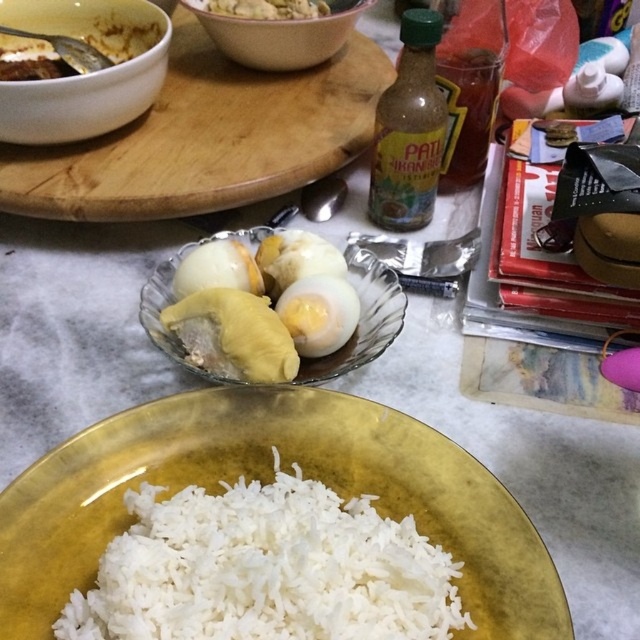
Which of these two, translucent glass bowl at center or smooth white rice at bottom, stands taller?

translucent glass bowl at center

Does point (161, 272) come in front of point (234, 13)?

Yes, it is in front of point (234, 13).

Which is behind, point (189, 369) or point (241, 4)?

Point (241, 4)

Where is `translucent glass bowl at center`? The image size is (640, 640). translucent glass bowl at center is located at coordinates (364, 320).

At what (x,y) coordinates should I click in order to perform the action: click on pink ceramic bowl at upper center. Please return your answer as a coordinate pair (x, y). This screenshot has height=640, width=640. Looking at the image, I should click on (276, 36).

Between pink ceramic bowl at upper center and yellow matte durian at center, which one appears on the left side from the viewer's perspective?

From the viewer's perspective, yellow matte durian at center appears more on the left side.

Is point (237, 28) behind point (193, 278)?

Yes, point (237, 28) is behind point (193, 278).

Find the location of `pink ceramic bowl at upper center`. pink ceramic bowl at upper center is located at coordinates (276, 36).

Who is positioned more to the right, wooden cutting board at upper center or yellowish matte durian at center?

Positioned to the right is yellowish matte durian at center.

Between point (368, 84) and point (262, 372), which one is positioned behind?

The point (368, 84) is behind.

Find the location of a particular element. This screenshot has width=640, height=640. wooden cutting board at upper center is located at coordinates (205, 138).